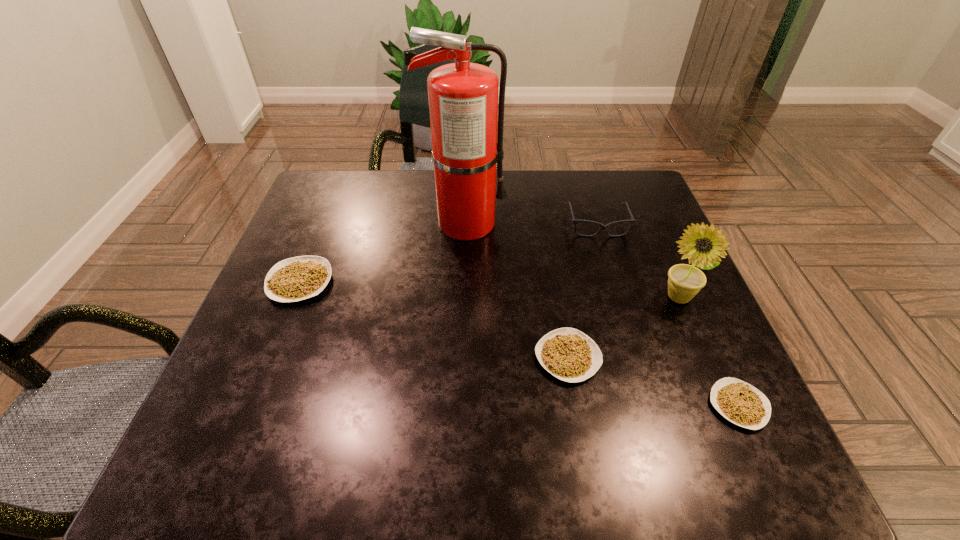
Locate an element on the screen. The image size is (960, 540). vacant region between the tallest legume and the sunflower is located at coordinates (489, 290).

Identify the location of vacant point located between the rightmost legume and the tallest object. (602, 314).

Find the location of a particular element. This screenshot has height=540, width=960. vacant space that's between the second legume from right to left and the spectacles is located at coordinates (583, 291).

Locate an element on the screen. Image resolution: width=960 pixels, height=540 pixels. free space between the rightmost legume and the sunflower is located at coordinates (708, 352).

Find the location of a particular element. vacant space that's between the second legume from right to left and the shortest legume is located at coordinates (653, 381).

You are a GUI agent. You are given a task and a screenshot of the screen. Output one action in this format:
    pyautogui.click(x=<x>, y=<y>)
    Task: Click on the vacant area that lies between the fire extinguisher and the sunflower
    
    Given the screenshot: What is the action you would take?
    pyautogui.click(x=571, y=260)

Where is `vacant area that lies between the spectacles and the rightmost legume`? This screenshot has width=960, height=540. vacant area that lies between the spectacles and the rightmost legume is located at coordinates (668, 315).

Locate an element on the screen. This screenshot has width=960, height=540. free spot between the second shortest object and the sunflower is located at coordinates (623, 327).

Identify the location of vacant area between the fire extinguisher and the fourth shortest object. (531, 224).

Locate an element on the screen. The height and width of the screenshot is (540, 960). vacant area that lies between the spectacles and the leftmost legume is located at coordinates (448, 253).